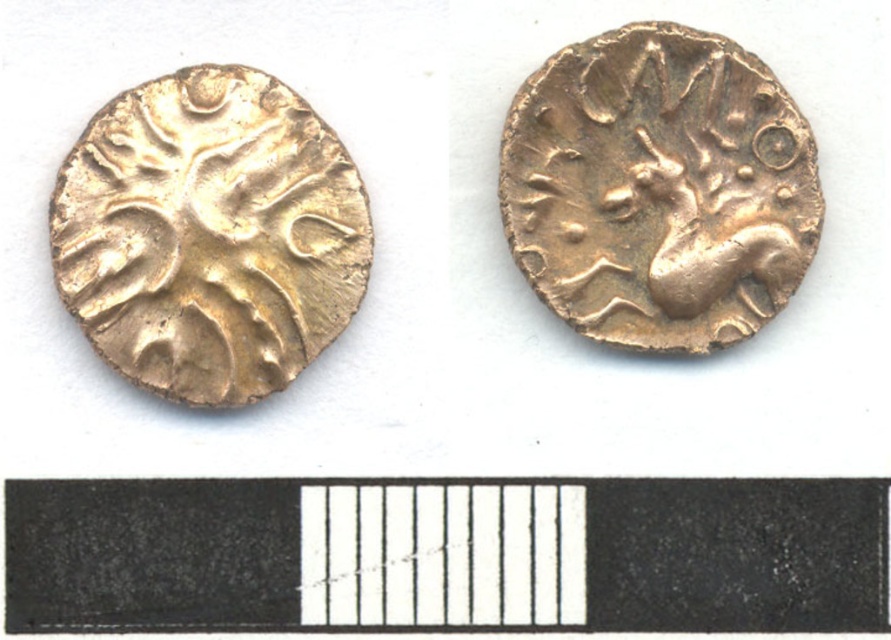
You are an archaeologist examining the coins. Which coin is closer to the front of the image, the gold textured horse at upper right or the gold textured coin at left?

The gold textured horse at upper right is closer to the front of the image because it is positioned in front of the gold textured coin at left.

You are an archaeologist examining two ancient coins. You notice the gold textured horse at upper right and the gold textured coin at left. Which coin has a larger diameter?

The gold textured coin at left has a larger diameter than the gold textured horse at upper right.